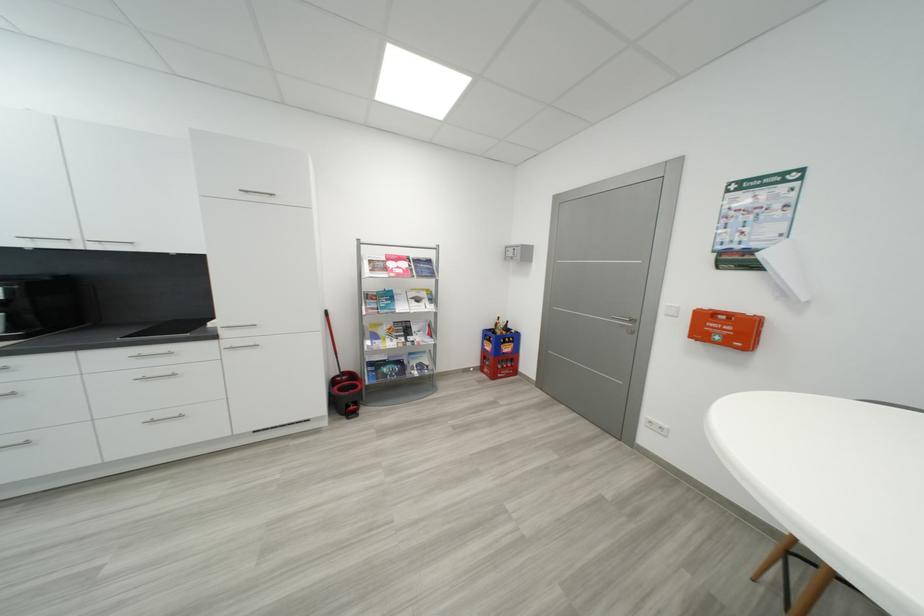
The width and height of the screenshot is (924, 616). What do you see at coordinates (343, 382) in the screenshot?
I see `a red mop handle` at bounding box center [343, 382].